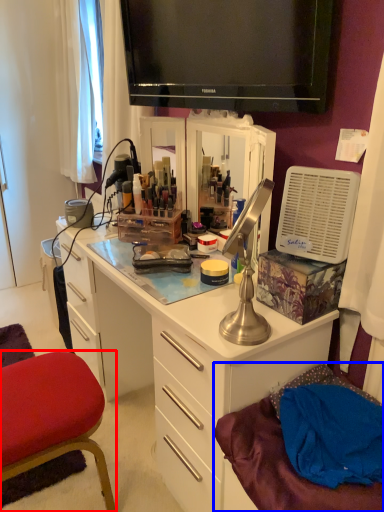
Question: Which of the following is the closest to the observer, chair (highlighted by a red box) or wide (highlighted by a blue box)?

Choices:
 (A) chair
 (B) wide

Answer: (B)